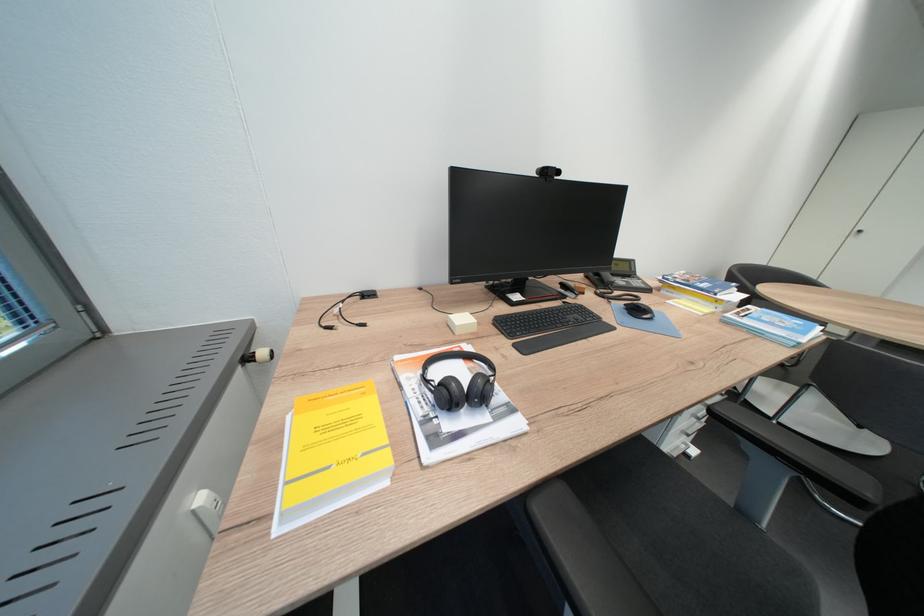
Where is `white radiator knob`? white radiator knob is located at coordinates (247, 358).